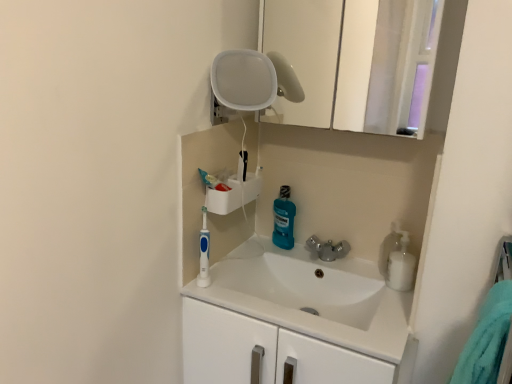
Question: From the image's perspective, does white glossy sink at center appear lower than blue plastic toothbrush at center-left?

Choices:
 (A) yes
 (B) no

Answer: (A)

Question: Does white glossy sink at center appear on the left side of blue plastic toothbrush at center-left?

Choices:
 (A) yes
 (B) no

Answer: (B)

Question: Considering the relative sizes of white glossy sink at center and blue plastic toothbrush at center-left in the image provided, is white glossy sink at center wider than blue plastic toothbrush at center-left?

Choices:
 (A) no
 (B) yes

Answer: (B)

Question: From the image's perspective, is white glossy sink at center on blue plastic toothbrush at center-left?

Choices:
 (A) yes
 (B) no

Answer: (B)

Question: Would you say white glossy sink at center is a long distance from blue plastic toothbrush at center-left?

Choices:
 (A) yes
 (B) no

Answer: (B)

Question: Looking at the image, does white glossy bottle at right, the 2th cleaning product positioned from the left, seem bigger or smaller compared to blue glossy mouthwash at center, which is the 2th cleaning product in front-to-back order?

Choices:
 (A) small
 (B) big

Answer: (A)

Question: Would you say white glossy bottle at right, the 1th cleaning product positioned from the front, is to the left or to the right of blue glossy mouthwash at center, acting as the 1th cleaning product starting from the back, in the picture?

Choices:
 (A) left
 (B) right

Answer: (B)

Question: Considering their positions, is white glossy bottle at right, the 2th cleaning product positioned from the left, located in front of or behind blue glossy mouthwash at center, marked as the 1th cleaning product in a left-to-right arrangement?

Choices:
 (A) behind
 (B) front

Answer: (B)

Question: In terms of height, does white glossy bottle at right, which is the second cleaning product in back-to-front order, look taller or shorter compared to blue glossy mouthwash at center, which is the 2th cleaning product in front-to-back order?

Choices:
 (A) tall
 (B) short

Answer: (B)

Question: Is point (317, 283) closer or farther from the camera than point (388, 266)?

Choices:
 (A) farther
 (B) closer

Answer: (A)

Question: In terms of width, does white glossy sink at center look wider or thinner when compared to white glossy bottle at right, which is the second cleaning product in back-to-front order?

Choices:
 (A) thin
 (B) wide

Answer: (B)

Question: Is white glossy sink at center taller or shorter than white glossy bottle at right, which is the second cleaning product in back-to-front order?

Choices:
 (A) tall
 (B) short

Answer: (A)

Question: Considering the relative positions of white glossy sink at center and white glossy bottle at right, the 1th cleaning product positioned from the front, in the image provided, is white glossy sink at center to the left or to the right of white glossy bottle at right, the 1th cleaning product positioned from the front,?

Choices:
 (A) left
 (B) right

Answer: (A)

Question: Based on their positions, is blue glossy mouthwash at center, which is the 2th cleaning product in front-to-back order, located to the left or right of white glossy medicine cabinet at upper center?

Choices:
 (A) right
 (B) left

Answer: (B)

Question: Looking at the image, does blue glossy mouthwash at center, positioned as the second cleaning product in right-to-left order, seem bigger or smaller compared to white glossy medicine cabinet at upper center?

Choices:
 (A) small
 (B) big

Answer: (A)